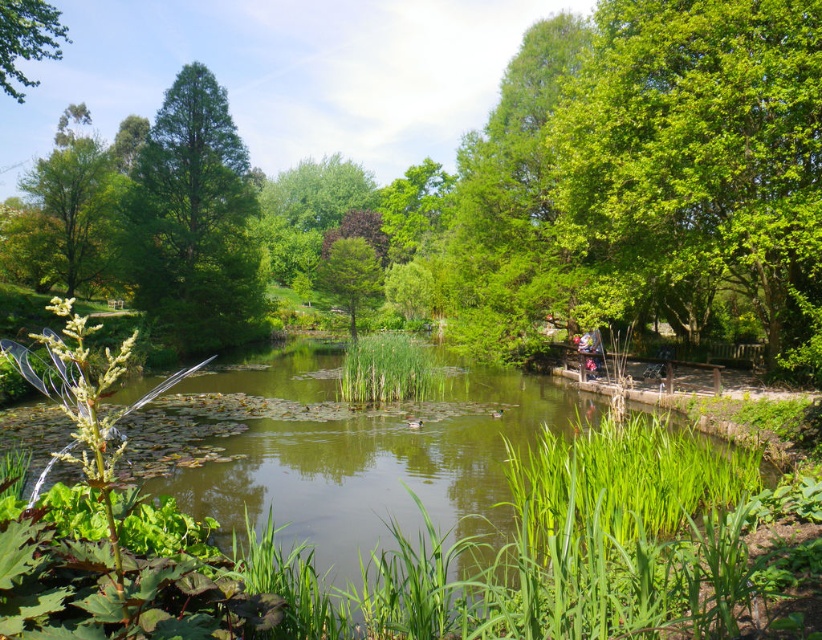
Question: Which object is positioned closest to the green grassy river at center?

Choices:
 (A) green glossy tree at upper left
 (B) green matte tree at center
 (C) green leafy tree at upper right
 (D) green leafy tree at left

Answer: (C)

Question: Estimate the real-world distances between objects in this image. Which object is closer to the green grassy river at center?

Choices:
 (A) green leafy tree at upper left
 (B) green leafy tree at left

Answer: (A)

Question: From the image, what is the correct spatial relationship of green leafy tree at upper left in relation to green matte tree at center?

Choices:
 (A) above
 (B) below

Answer: (A)

Question: Which is nearer to the green glossy tree at upper left?

Choices:
 (A) green matte tree at center
 (B) green leafy tree at upper right

Answer: (A)

Question: Does green grassy river at center have a greater width compared to green leafy tree at upper left?

Choices:
 (A) yes
 (B) no

Answer: (B)

Question: Does green grassy river at center have a smaller size compared to green leafy tree at left?

Choices:
 (A) no
 (B) yes

Answer: (B)